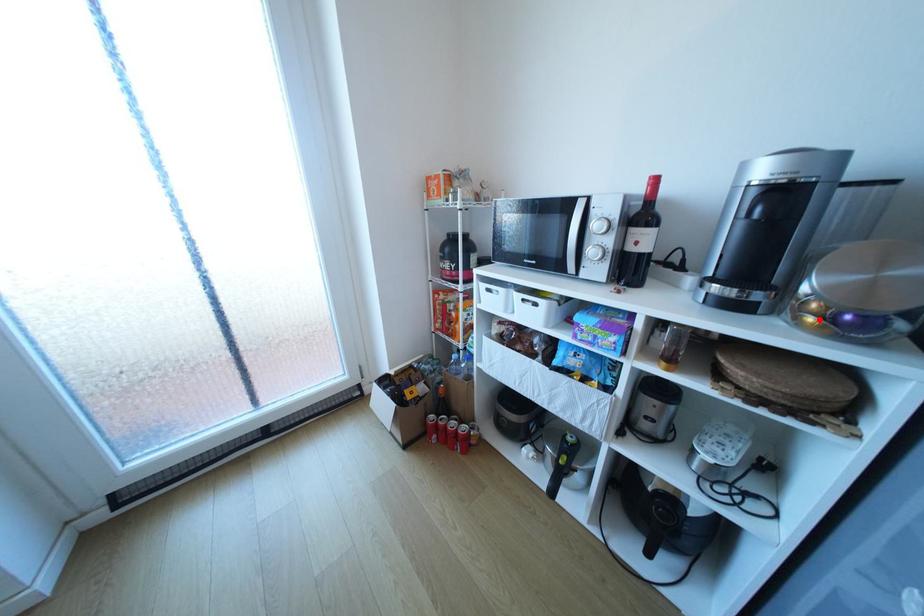
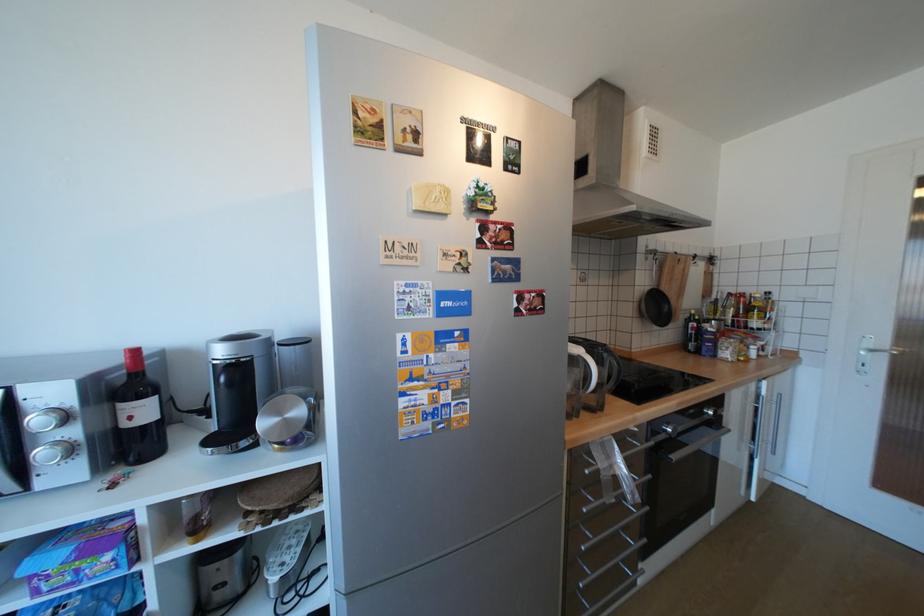
Locate, in the second image, the point that corresponds to the highlighted location in the first image.

(286, 446)